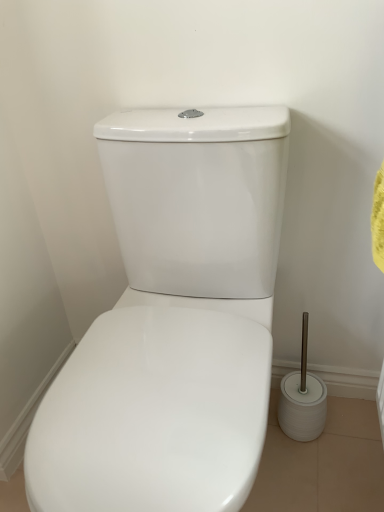
What do you see at coordinates (173, 321) in the screenshot? The image size is (384, 512). I see `white glossy toilet at center` at bounding box center [173, 321].

What is the approximate height of white glossy toilet at center?

30.24 inches.

The image size is (384, 512). In order to click on white glossy toilet at center in this screenshot , I will do `click(173, 321)`.

Where is `white glossy toilet at center`? The image size is (384, 512). white glossy toilet at center is located at coordinates (173, 321).